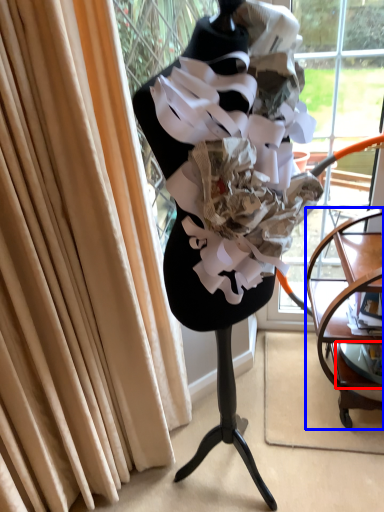
Question: Which point is closer to the camera, shelf (highlighted by a red box) or furniture (highlighted by a blue box)?

Choices:
 (A) shelf
 (B) furniture

Answer: (B)